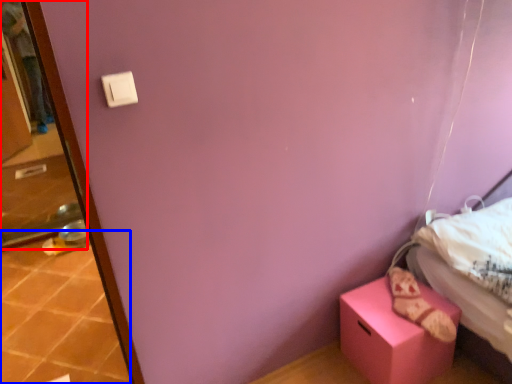
Question: Which object is further to the camera taking this photo, screen door (highlighted by a red box) or tile (highlighted by a blue box)?

Choices:
 (A) screen door
 (B) tile

Answer: (A)